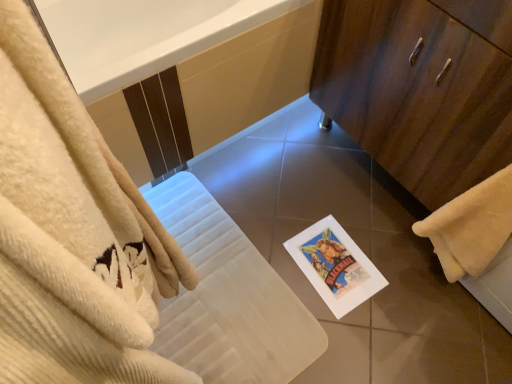
Find the location of a particular element. wooden cabinet at right is located at coordinates (420, 88).

The height and width of the screenshot is (384, 512). I want to click on white glossy bathtub at upper center, so click(248, 76).

Describe the element at coordinates (335, 266) in the screenshot. The image size is (512, 384). I see `white paper postcard at center` at that location.

At what (x,y) coordinates should I click in order to perform the action: click on wooden cabinet at right. Please return your answer as a coordinate pair (x, y). Looking at the image, I should click on (420, 88).

Considering the relative positions of white paper postcard at center and white glossy bathtub at upper center in the image provided, is white paper postcard at center to the right of white glossy bathtub at upper center from the viewer's perspective?

Yes, white paper postcard at center is to the right of white glossy bathtub at upper center.

From a real-world perspective, is white paper postcard at center beneath white glossy bathtub at upper center?

Yes, from a real-world perspective, white paper postcard at center is under white glossy bathtub at upper center.

Can you tell me how much white paper postcard at center and white glossy bathtub at upper center differ in facing direction?

white paper postcard at center and white glossy bathtub at upper center are facing 94.5 degrees away from each other.

Does white paper postcard at center turn towards white glossy bathtub at upper center?

No, white paper postcard at center is not facing towards white glossy bathtub at upper center.

At what (x,y) coordinates should I click in order to perform the action: click on bath beneath the wooden cabinet at right (from a real-world perspective). Please return your answer as a coordinate pair (x, y). This screenshot has width=512, height=384. Looking at the image, I should click on [248, 76].

From a real-world perspective, is wooden cabinet at right beneath white glossy bathtub at upper center?

Incorrect, from a real-world perspective, wooden cabinet at right is higher than white glossy bathtub at upper center.

Considering the relative sizes of wooden cabinet at right and white glossy bathtub at upper center in the image provided, is wooden cabinet at right bigger than white glossy bathtub at upper center?

No, wooden cabinet at right is not bigger than white glossy bathtub at upper center.

From the image's perspective, which is above, wooden cabinet at right or white glossy bathtub at upper center?

white glossy bathtub at upper center.

Consider the image. Is wooden cabinet at right thinner than white paper postcard at center?

In fact, wooden cabinet at right might be wider than white paper postcard at center.

Is point (402, 111) closer to camera compared to point (328, 251)?

Yes, point (402, 111) is in front of point (328, 251).

From the image's perspective, between wooden cabinet at right and white paper postcard at center, who is located below?

white paper postcard at center, from the image's perspective.

Which object is closer to the camera, wooden cabinet at right or white paper postcard at center?

wooden cabinet at right is more forward.

Considering the sizes of objects white paper postcard at center and wooden cabinet at right in the image provided, who is bigger, white paper postcard at center or wooden cabinet at right?

With larger size is wooden cabinet at right.

Which of these two, white paper postcard at center or wooden cabinet at right, is wider?

With larger width is wooden cabinet at right.

From a real-world perspective, is white paper postcard at center above or below wooden cabinet at right?

From a real-world perspective, white paper postcard at center is physically below wooden cabinet at right.

Which object is thinner, white paper postcard at center or yellow fluffy towel at lower right?

yellow fluffy towel at lower right is thinner.

From the image's perspective, would you say white paper postcard at center is shown under yellow fluffy towel at lower right?

Correct, white paper postcard at center appears lower than yellow fluffy towel at lower right in the image.

Could you tell me if white paper postcard at center is turned towards yellow fluffy towel at lower right?

No, white paper postcard at center does not turn towards yellow fluffy towel at lower right.

Where is `postcard below the yellow fluffy towel at lower right (from a real-world perspective)`? This screenshot has height=384, width=512. postcard below the yellow fluffy towel at lower right (from a real-world perspective) is located at coordinates (335, 266).

Considering the positions of objects white glossy bathtub at upper center and white paper postcard at center in the image provided, who is behind, white glossy bathtub at upper center or white paper postcard at center?

Positioned behind is white paper postcard at center.

Considering the points (262, 48) and (362, 297), which point is in front, point (262, 48) or point (362, 297)?

The point (262, 48) is in front.

Looking at this image, can we say white glossy bathtub at upper center lies outside white paper postcard at center?

Yes, white glossy bathtub at upper center is located beyond the bounds of white paper postcard at center.

How many degrees apart are the facing directions of white glossy bathtub at upper center and white paper postcard at center?

They differ by 94.5 degrees in their facing directions.

Consider the image. Based on their sizes in the image, would you say yellow fluffy towel at lower right is bigger or smaller than white paper postcard at center?

Considering their sizes, yellow fluffy towel at lower right takes up more space than white paper postcard at center.

From a real-world perspective, between yellow fluffy towel at lower right and white paper postcard at center, who is vertically higher?

yellow fluffy towel at lower right, from a real-world perspective.

Is yellow fluffy towel at lower right next to white paper postcard at center?

No.

How different are the orientations of yellow fluffy towel at lower right and white paper postcard at center in degrees?

There is a 5.05-degree angle between the facing directions of yellow fluffy towel at lower right and white paper postcard at center.

The width and height of the screenshot is (512, 384). Find the location of `postcard that is on the right side of white glossy bathtub at upper center`. postcard that is on the right side of white glossy bathtub at upper center is located at coordinates (335, 266).

Identify the location of bathroom cabinet above the white glossy bathtub at upper center (from a real-world perspective). (420, 88).

From the image, which object appears to be nearer to yellow fluffy towel at lower right, white paper postcard at center or white glossy bathtub at upper center?

The object closer to yellow fluffy towel at lower right is white paper postcard at center.

From the image, which object appears to be nearer to wooden cabinet at right, yellow fluffy towel at lower right or white glossy bathtub at upper center?

yellow fluffy towel at lower right.

When comparing their distances from wooden cabinet at right, does white paper postcard at center or white glossy bathtub at upper center seem closer?

white glossy bathtub at upper center.

Looking at this image, estimate the real-world distances between objects in this image. Which object is closer to white glossy bathtub at upper center, yellow fluffy towel at lower right or wooden cabinet at right?

wooden cabinet at right is positioned closer to the anchor white glossy bathtub at upper center.

Looking at the image, which one is located further to wooden cabinet at right, white paper postcard at center or yellow fluffy towel at lower right?

white paper postcard at center lies further to wooden cabinet at right than the other object.

Looking at the image, which one is located closer to white paper postcard at center, wooden cabinet at right or white glossy bathtub at upper center?

wooden cabinet at right is closer to white paper postcard at center.

From the picture: Considering their positions, is yellow fluffy towel at lower right positioned further to white paper postcard at center than wooden cabinet at right?

Based on the image, wooden cabinet at right appears to be further to white paper postcard at center.

Estimate the real-world distances between objects in this image. Which object is closer to white glossy bathtub at upper center, wooden cabinet at right or yellow fluffy towel at lower right?

wooden cabinet at right lies closer to white glossy bathtub at upper center than the other object.

You are a GUI agent. You are given a task and a screenshot of the screen. Output one action in this format:
    pyautogui.click(x=<x>, y=<y>)
    Task: Click on the bathroom cabinet located between white glossy bathtub at upper center and yellow fluffy towel at lower right in the left-right direction
    This screenshot has height=384, width=512.
    Given the screenshot: What is the action you would take?
    pyautogui.click(x=420, y=88)

Locate an element on the screen. bathroom cabinet that lies between white glossy bathtub at upper center and white paper postcard at center from top to bottom is located at coordinates (420, 88).

The height and width of the screenshot is (384, 512). I want to click on towel between white glossy bathtub at upper center and white paper postcard at center vertically, so click(471, 226).

Identify the location of bathroom cabinet between yellow fluffy towel at lower right and white paper postcard at center in the front-back direction. The image size is (512, 384). (420, 88).